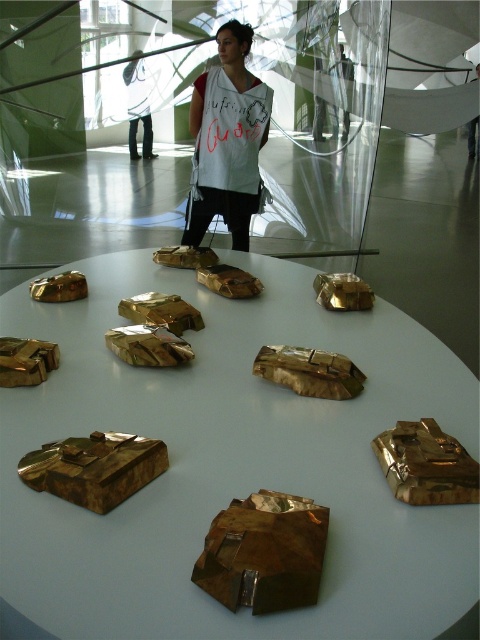
Does gold metallic objects at center have a greater width compared to gold metallic sculpture at center?

Yes.

Where is `gold metallic objects at center`? The height and width of the screenshot is (640, 480). gold metallic objects at center is located at coordinates (231, 461).

Is point (391, 378) in front of point (259, 604)?

No.

At what (x,y) coordinates should I click in order to perform the action: click on gold metallic objects at center. Please return your answer as a coordinate pair (x, y). The image size is (480, 640). Looking at the image, I should click on (231, 461).

Is gold metallic objects at center above gold metallic sculpture at lower left?

Indeed, gold metallic objects at center is positioned over gold metallic sculpture at lower left.

Between gold metallic objects at center and gold metallic sculpture at lower left, which one is positioned lower?

gold metallic sculpture at lower left is lower down.

Between point (7, 532) and point (137, 440), which one is positioned in front?

Positioned in front is point (7, 532).

Identify the location of gold metallic objects at center. The height and width of the screenshot is (640, 480). (231, 461).

Does gold metallic sculpture at center appear under white paper at center?

Indeed, gold metallic sculpture at center is positioned under white paper at center.

Is gold metallic sculpture at center to the right of white paper at center from the viewer's perspective?

Correct, you'll find gold metallic sculpture at center to the right of white paper at center.

The image size is (480, 640). In order to click on gold metallic sculpture at center in this screenshot , I will do `click(264, 552)`.